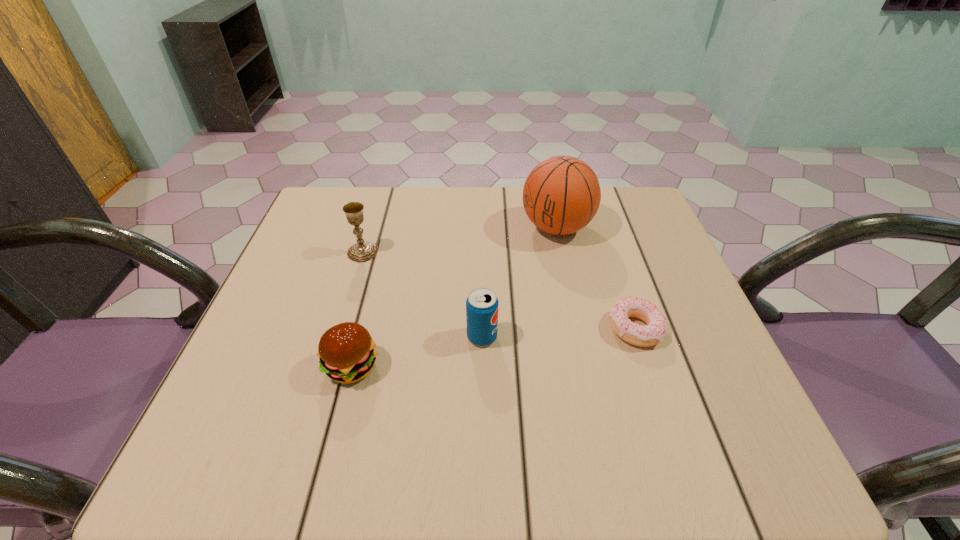
The image size is (960, 540). What are the coordinates of `basketball` in the screenshot? It's located at (561, 195).

Where is `chalice`? This screenshot has width=960, height=540. chalice is located at coordinates (362, 251).

Locate an element on the screen. The height and width of the screenshot is (540, 960). the third object from right to left is located at coordinates click(x=482, y=304).

This screenshot has width=960, height=540. I want to click on the second shortest object, so click(347, 354).

In order to click on doughnut in this screenshot , I will do `click(639, 335)`.

The height and width of the screenshot is (540, 960). I want to click on vacant region located on the left of the basketball, so click(x=436, y=227).

Find the location of a particular element. This screenshot has height=540, width=960. vacant space situated 0.210m on the front of the chalice is located at coordinates (339, 331).

At what (x,y) coordinates should I click in order to perform the action: click on free space located on the left of the third object from left to right. Please return your answer as a coordinate pair (x, y). Looking at the image, I should click on (387, 337).

The image size is (960, 540). Identify the location of free region located 0.140m on the right of the hamburger. (454, 366).

Identify the location of free region located on the front of the doughnut. The height and width of the screenshot is (540, 960). (684, 476).